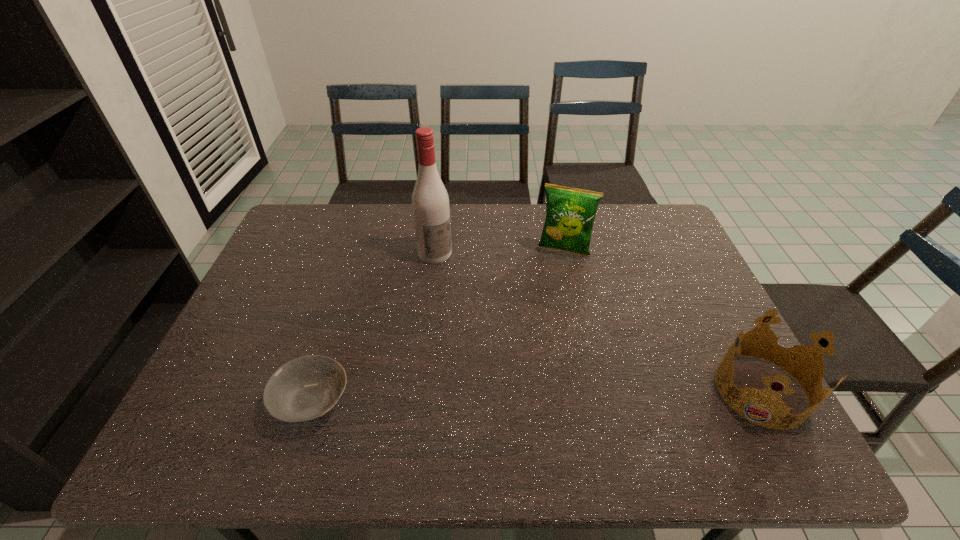
Find the location of `free space that satisfies the following two spatial constraints: 1. on the back side of the bowl; 2. on the left side of the second object from right to left`. free space that satisfies the following two spatial constraints: 1. on the back side of the bowl; 2. on the left side of the second object from right to left is located at coordinates (359, 251).

At what (x,y) coordinates should I click in order to perform the action: click on vacant space that satisfies the following two spatial constraints: 1. on the back side of the bowl; 2. on the left side of the tallest object. Please return your answer as a coordinate pair (x, y). The image size is (960, 540). Looking at the image, I should click on (359, 253).